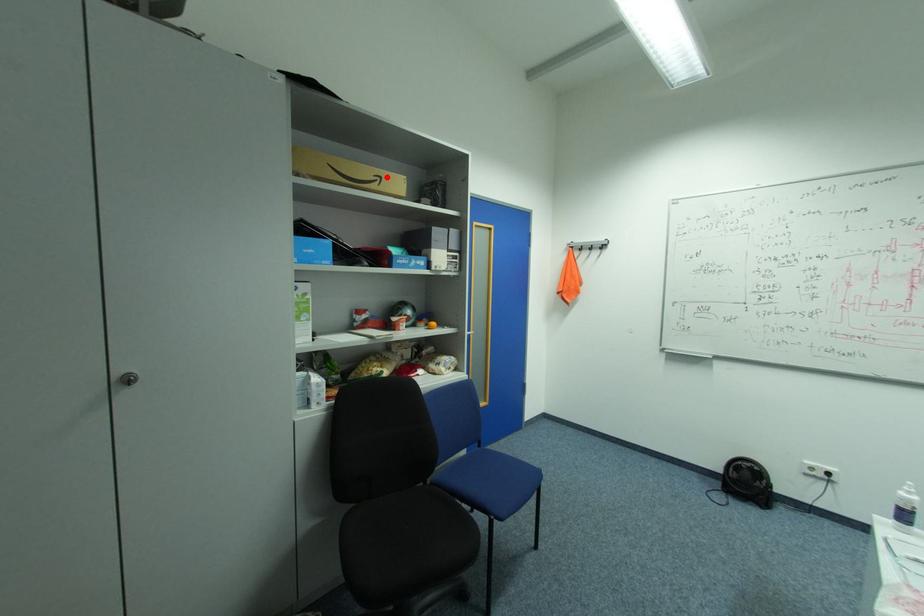
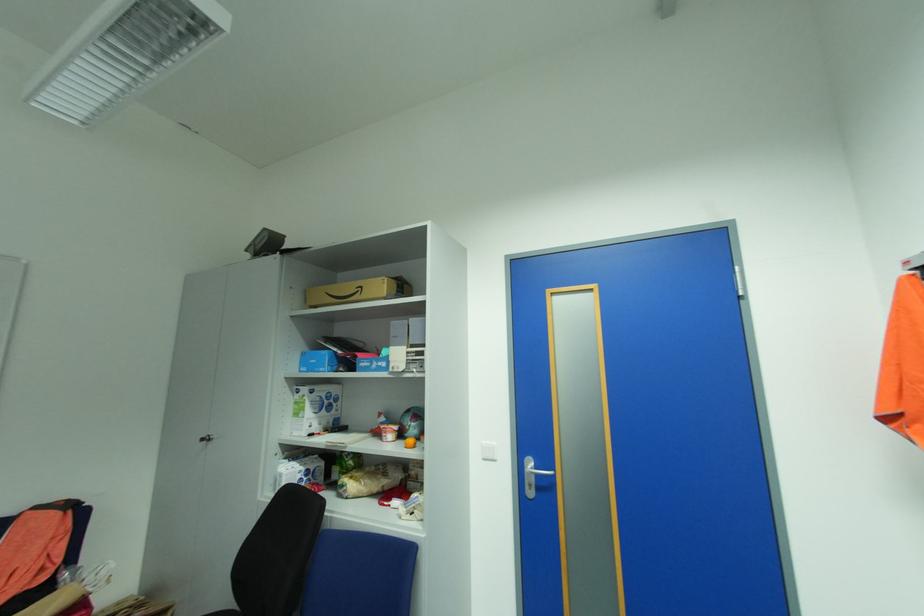
Find the pixel in the second image that matches the highlighted location in the first image.

(368, 286)